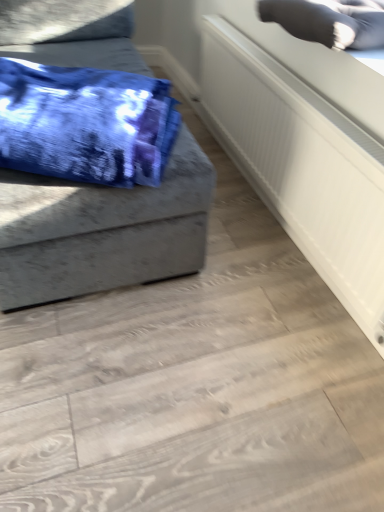
Question: Is gray fabric pillow at upper right shorter than blue tie-dye fabric at left?

Choices:
 (A) yes
 (B) no

Answer: (A)

Question: Is gray fabric pillow at upper right positioned with its back to blue tie-dye fabric at left?

Choices:
 (A) yes
 (B) no

Answer: (B)

Question: Is gray fabric pillow at upper right smaller than blue tie-dye fabric at left?

Choices:
 (A) yes
 (B) no

Answer: (A)

Question: From the image's perspective, is gray fabric pillow at upper right on blue tie-dye fabric at left?

Choices:
 (A) yes
 (B) no

Answer: (A)

Question: Is gray fabric pillow at upper right thinner than blue tie-dye fabric at left?

Choices:
 (A) yes
 (B) no

Answer: (A)

Question: Is gray fabric pillow at upper right wider than blue tie-dye fabric at left?

Choices:
 (A) no
 (B) yes

Answer: (A)

Question: Is blue tie-dye fabric at left positioned in front of white textured radiator at upper right?

Choices:
 (A) no
 (B) yes

Answer: (B)

Question: From a real-world perspective, is blue tie-dye fabric at left located beneath white textured radiator at upper right?

Choices:
 (A) yes
 (B) no

Answer: (B)

Question: Can you confirm if blue tie-dye fabric at left is taller than white textured radiator at upper right?

Choices:
 (A) yes
 (B) no

Answer: (A)

Question: Is blue tie-dye fabric at left bigger than white textured radiator at upper right?

Choices:
 (A) yes
 (B) no

Answer: (A)

Question: Considering the relative positions of blue tie-dye fabric at left and white textured radiator at upper right in the image provided, is blue tie-dye fabric at left to the right of white textured radiator at upper right from the viewer's perspective?

Choices:
 (A) yes
 (B) no

Answer: (B)

Question: Considering the relative sizes of blue tie-dye fabric at left and white textured radiator at upper right in the image provided, is blue tie-dye fabric at left thinner than white textured radiator at upper right?

Choices:
 (A) yes
 (B) no

Answer: (B)

Question: Considering the relative sizes of gray fabric pillow at upper right and white textured radiator at upper right in the image provided, is gray fabric pillow at upper right thinner than white textured radiator at upper right?

Choices:
 (A) no
 (B) yes

Answer: (A)